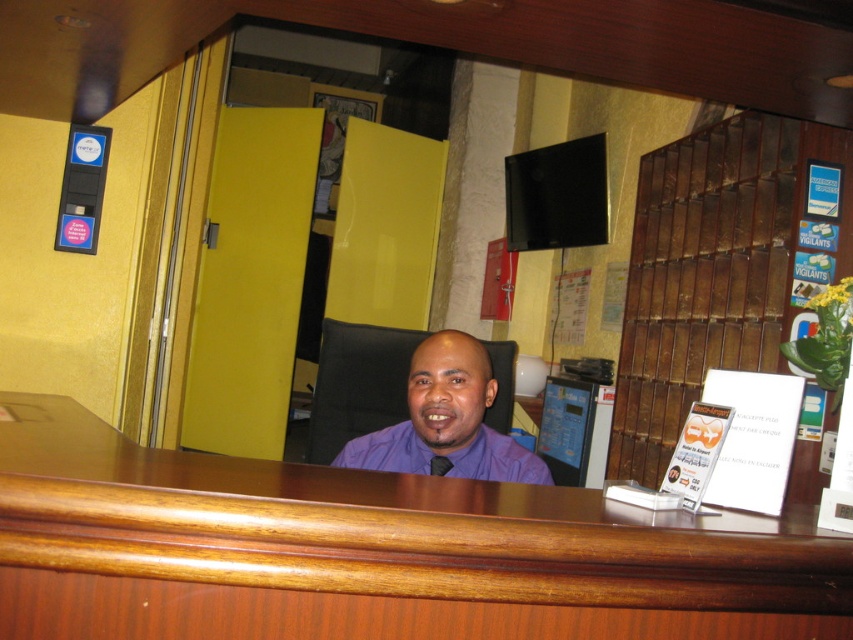
In the scene shown: Who is positioned more to the right, purple shirt at center or purple satin tie at center?

purple shirt at center

Which of these two, purple shirt at center or purple satin tie at center, stands shorter?

With less height is purple satin tie at center.

Measure the distance between point [424,387] and camera.

A distance of 6.08 feet exists between point [424,387] and camera.

Identify the location of purple shirt at center. This screenshot has height=640, width=853. (447, 420).

Who is higher up, brown wood table at center or purple matte dress shirt at center?

brown wood table at center is higher up.

Which is behind, point (296, 465) or point (364, 461)?

The point (364, 461) is behind.

Image resolution: width=853 pixels, height=640 pixels. In order to click on brown wood table at center in this screenshot , I will do `click(370, 552)`.

Is purple shirt at center closer to the viewer compared to purple matte dress shirt at center?

Yes, purple shirt at center is in front of purple matte dress shirt at center.

Between purple shirt at center and purple matte dress shirt at center, which one is positioned lower?

purple matte dress shirt at center is lower down.

Is point (445, 332) positioned behind point (390, 445)?

No, it is not.

Identify the location of purple shirt at center. The image size is (853, 640). (447, 420).